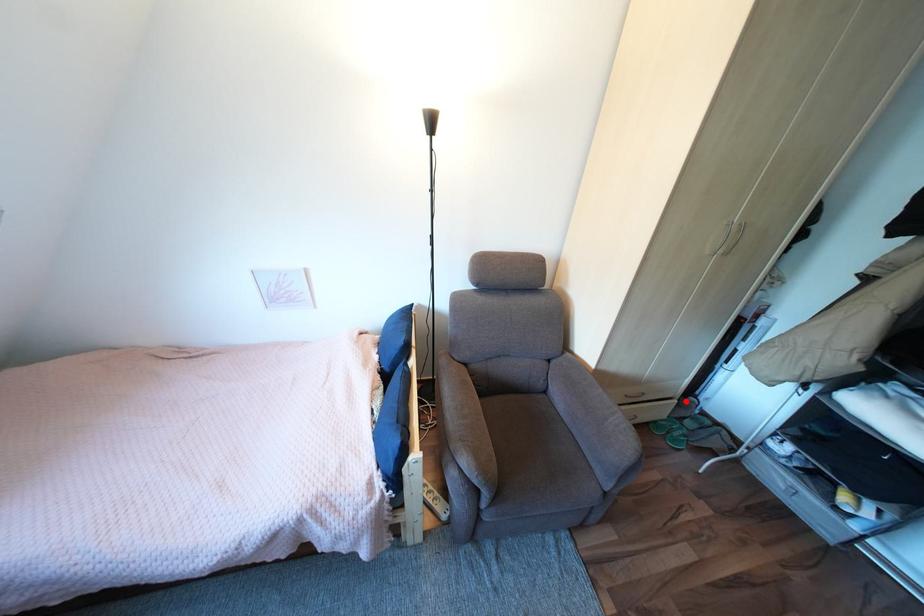
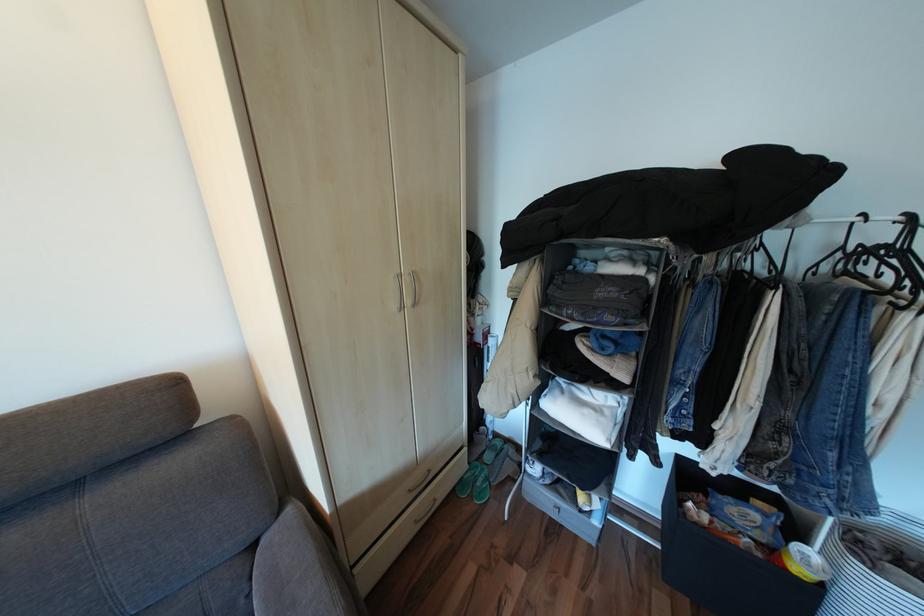
The point at the highlighted location is marked in the first image. Where is the corresponding point in the second image?

(477, 448)